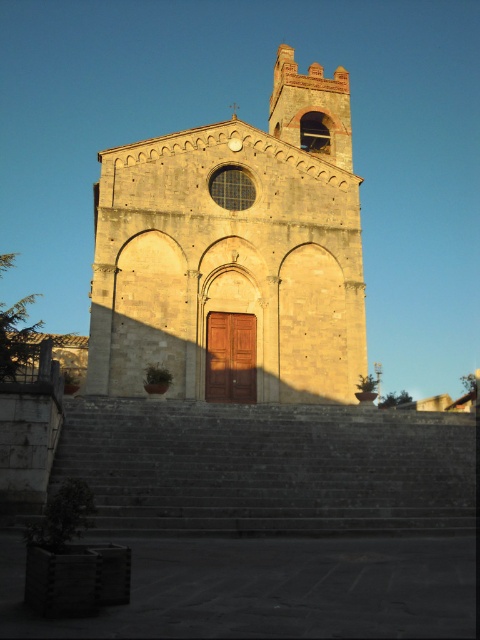
Can you confirm if golden stone church at center is positioned to the right of gray stone stairs at lower center?

Yes, golden stone church at center is to the right of gray stone stairs at lower center.

Is golden stone church at center taller than gray stone stairs at lower center?

Yes, golden stone church at center is taller than gray stone stairs at lower center.

Find the location of a particular element. golden stone church at center is located at coordinates (235, 253).